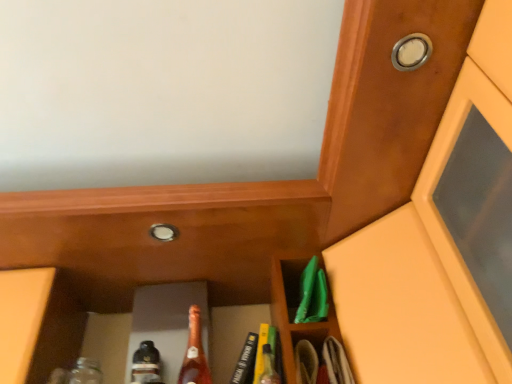
What is the approximate height of translucent glass bottle at center?

19.08 centimeters.

You are a GUI agent. You are given a task and a screenshot of the screen. Output one action in this format:
    pyautogui.click(x=<x>, y=<y>)
    Task: Click on the matte brown cabinet at center
    This screenshot has height=384, width=512.
    Given the screenshot: What is the action you would take?
    pyautogui.click(x=172, y=241)

This screenshot has width=512, height=384. What do you see at coordinates (396, 109) in the screenshot? I see `wooden door at upper right` at bounding box center [396, 109].

What do you see at coordinates (195, 353) in the screenshot?
I see `matte glass bottle at center` at bounding box center [195, 353].

Image resolution: width=512 pixels, height=384 pixels. Identify the location of metallic silver knob at upper right, marked as the second knob in a bottom-to-top arrangement. (411, 52).

Could you tell me if metallic silver knob at upper right, which is the 1th knob in right-to-left order, is turned towards translucent glass bottle at center?

No, metallic silver knob at upper right, which is the 1th knob in right-to-left order, is not facing towards translucent glass bottle at center.

Which object is thinner, metallic silver knob at upper right, which is the 1th knob in right-to-left order, or translucent glass bottle at center?

Thinner between the two is translucent glass bottle at center.

Looking at this image, from a real-world perspective, who is located lower, metallic silver knob at upper right, which is the 1th knob in right-to-left order, or translucent glass bottle at center?

translucent glass bottle at center.

How far apart are matte glass bottle at center and translucent glass bottle at center?

7.55 inches.

From the image's perspective, which object appears higher, matte glass bottle at center or translucent glass bottle at center?

From the image's view, translucent glass bottle at center is above.

From a real-world perspective, which object rests below the other?

In real-world perspective, translucent glass bottle at center is lower.

Is translucent glass bottle at center inside matte glass bottle at center?

No, translucent glass bottle at center is not surrounded by matte glass bottle at center.

Which of these two, silver metallic knob at center, the 1th knob ordered from the bottom, or metallic silver knob at upper right, the 2th knob from the back, is smaller?

metallic silver knob at upper right, the 2th knob from the back.

Which is behind, silver metallic knob at center, which is counted as the 1th knob, starting from the left, or metallic silver knob at upper right, which is the 1th knob in right-to-left order?

silver metallic knob at center, which is counted as the 1th knob, starting from the left, is more distant.

Is silver metallic knob at center, which is counted as the second knob, starting from the top, placed right next to metallic silver knob at upper right, marked as the second knob in a bottom-to-top arrangement?

silver metallic knob at center, which is counted as the second knob, starting from the top, and metallic silver knob at upper right, marked as the second knob in a bottom-to-top arrangement, are clearly separated.

Is wooden door at upper right facing away from silver metallic knob at center, which is counted as the second knob, starting from the top?

No, wooden door at upper right is not facing the opposite direction of silver metallic knob at center, which is counted as the second knob, starting from the top.

Which of these two, wooden door at upper right or silver metallic knob at center, which is counted as the second knob, starting from the top, is bigger?

With larger size is wooden door at upper right.

Between wooden door at upper right and silver metallic knob at center, which is counted as the second knob, starting from the top, which one has more height?

wooden door at upper right is taller.

From the picture: Which is closer to the camera, (376, 62) or (262, 378)?

Point (376, 62) is closer to the camera than point (262, 378).

Is wooden door at upper right at the right side of translucent glass bottle at center?

Indeed, wooden door at upper right is positioned on the right side of translucent glass bottle at center.

Based on the photo, from a real-world perspective, is wooden door at upper right located higher than translucent glass bottle at center?

Indeed, from a real-world perspective, wooden door at upper right stands above translucent glass bottle at center.

This screenshot has width=512, height=384. In order to click on bottle on the left of wooden door at upper right in this screenshot , I will do `click(269, 367)`.

Between point (152, 230) and point (441, 1), which one is positioned behind?

Point (152, 230)

Between silver metallic knob at center, acting as the first knob starting from the back, and wooden door at upper right, which one appears on the right side from the viewer's perspective?

wooden door at upper right.

Which of these two, silver metallic knob at center, which is counted as the second knob, starting from the top, or wooden door at upper right, stands taller?

Standing taller between the two is wooden door at upper right.

How different are the orientations of silver metallic knob at center, the 1th knob ordered from the bottom, and wooden door at upper right in degrees?

1.4 degrees.

Does translucent glass bottle at center have a larger size compared to matte glass bottle at center?

No.

Considering the sizes of translucent glass bottle at center and matte glass bottle at center in the image, is translucent glass bottle at center taller or shorter than matte glass bottle at center?

Clearly, translucent glass bottle at center is shorter compared to matte glass bottle at center.

In the image, there is a translucent glass bottle at center. At what (x,y) coordinates should I click in order to perform the action: click on beer bottle below it (from the image's perspective). Please return your answer as a coordinate pair (x, y). This screenshot has height=384, width=512. Looking at the image, I should click on (195, 353).

Considering the sizes of objects translucent glass bottle at center and matte glass bottle at center in the image provided, who is wider, translucent glass bottle at center or matte glass bottle at center?

With larger width is matte glass bottle at center.

The width and height of the screenshot is (512, 384). Identify the location of bottle that is on the left side of metallic silver knob at upper right, acting as the 1th knob starting from the front. (269, 367).

Identify the location of bottle that appears above the matte glass bottle at center (from the image's perspective). (269, 367).

Looking at the image, which one is located further to translucent glass bottle at center, silver metallic knob at center, acting as the first knob starting from the back, or matte glass bottle at center?

The object further to translucent glass bottle at center is silver metallic knob at center, acting as the first knob starting from the back.

Which object lies nearer to the anchor point metallic silver knob at upper right, acting as the 1th knob starting from the front, wooden door at upper right or matte brown cabinet at center?

The object closer to metallic silver knob at upper right, acting as the 1th knob starting from the front, is wooden door at upper right.

When comparing their distances from matte brown cabinet at center, does wooden door at upper right or matte glass bottle at center seem closer?

Among the two, matte glass bottle at center is located nearer to matte brown cabinet at center.

When comparing their distances from translucent glass bottle at center, does matte glass bottle at center or wooden door at upper right seem further?

Among the two, wooden door at upper right is located further to translucent glass bottle at center.

Looking at the image, which one is located closer to translucent glass bottle at center, wooden door at upper right or metallic silver knob at upper right, acting as the 1th knob starting from the front?

wooden door at upper right.

Looking at the image, which one is located closer to metallic silver knob at upper right, marked as the second knob in a bottom-to-top arrangement, wooden door at upper right or matte glass bottle at center?

Among the two, wooden door at upper right is located nearer to metallic silver knob at upper right, marked as the second knob in a bottom-to-top arrangement.

Which object lies nearer to the anchor point wooden door at upper right, silver metallic knob at center, the 1th knob ordered from the bottom, or matte glass bottle at center?

silver metallic knob at center, the 1th knob ordered from the bottom, lies closer to wooden door at upper right than the other object.

Estimate the real-world distances between objects in this image. Which object is further from metallic silver knob at upper right, marked as the second knob in a bottom-to-top arrangement, silver metallic knob at center, which is the 2th knob in right-to-left order, or wooden door at upper right?

silver metallic knob at center, which is the 2th knob in right-to-left order, is positioned further to the anchor metallic silver knob at upper right, marked as the second knob in a bottom-to-top arrangement.

Where is `cabinetry between silver metallic knob at center, which is counted as the second knob, starting from the top, and matte glass bottle at center vertically`? The height and width of the screenshot is (384, 512). cabinetry between silver metallic knob at center, which is counted as the second knob, starting from the top, and matte glass bottle at center vertically is located at coordinates 172,241.

I want to click on cabinetry between metallic silver knob at upper right, the 2th knob positioned from the left, and translucent glass bottle at center vertically, so click(x=172, y=241).

Locate an element on the screen. The width and height of the screenshot is (512, 384). cabinetry between wooden door at upper right and matte glass bottle at center along the z-axis is located at coordinates (172, 241).

Image resolution: width=512 pixels, height=384 pixels. What are the coordinates of `knob between metallic silver knob at upper right, acting as the 1th knob starting from the front, and matte brown cabinet at center, in the vertical direction` in the screenshot? It's located at (164, 232).